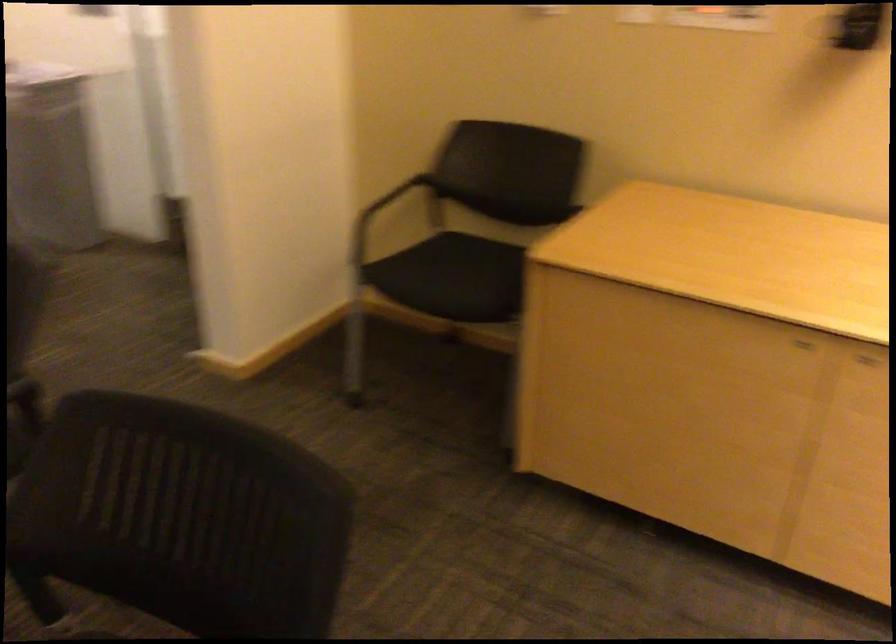
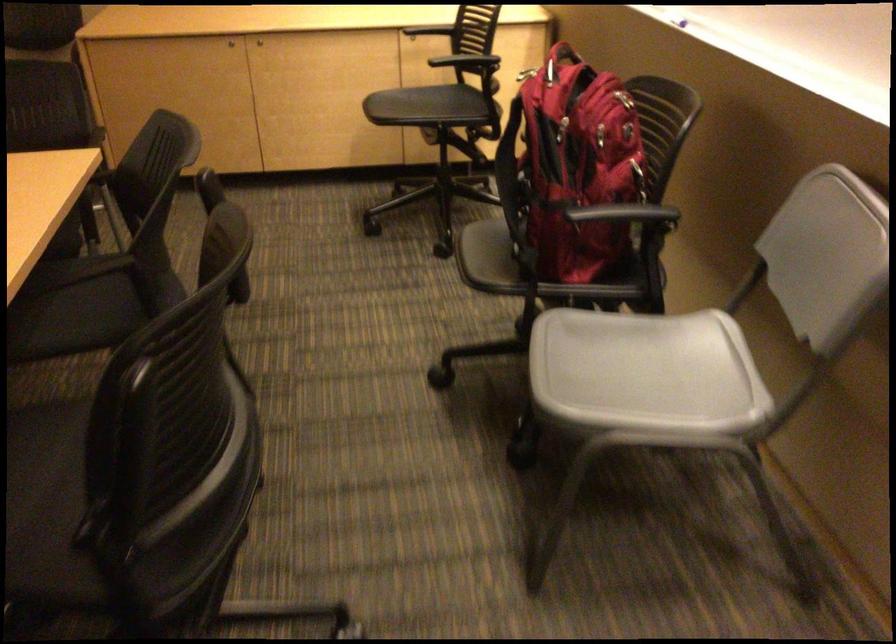
In the second image, find the point that corresponds to pixel 811 360 in the first image.

(230, 44)